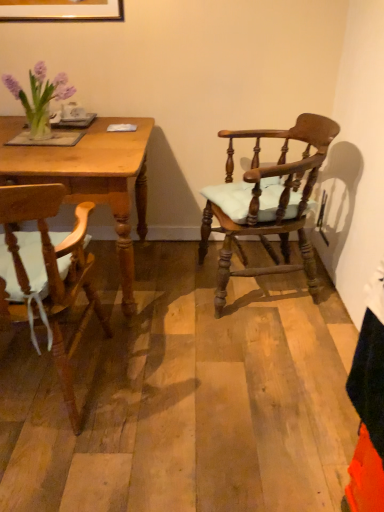
Question: From the image's perspective, is wooden chair with cushion at left, which appears as the 1th chair when viewed from the left, located beneath wooden table at left?

Choices:
 (A) yes
 (B) no

Answer: (A)

Question: Considering the relative positions of wooden chair with cushion at left, which is counted as the second chair, starting from the right, and wooden table at left in the image provided, is wooden chair with cushion at left, which is counted as the second chair, starting from the right, to the right of wooden table at left from the viewer's perspective?

Choices:
 (A) no
 (B) yes

Answer: (B)

Question: Are wooden chair with cushion at left, which is counted as the second chair, starting from the right, and wooden table at left making contact?

Choices:
 (A) no
 (B) yes

Answer: (A)

Question: Is wooden chair with cushion at left, which appears as the 1th chair when viewed from the left, looking in the opposite direction of wooden table at left?

Choices:
 (A) no
 (B) yes

Answer: (A)

Question: Would you say wooden chair with cushion at left, which appears as the 1th chair when viewed from the left, is outside wooden table at left?

Choices:
 (A) yes
 (B) no

Answer: (A)

Question: In terms of height, does wooden chair with cushion at right, placed as the second chair when sorted from left to right, look taller or shorter compared to wooden chair with cushion at left, which appears as the 1th chair when viewed from the left?

Choices:
 (A) short
 (B) tall

Answer: (A)

Question: Based on their positions, is wooden chair with cushion at right, the 1th chair positioned from the right, located to the left or right of wooden chair with cushion at left, which is counted as the second chair, starting from the right?

Choices:
 (A) right
 (B) left

Answer: (A)

Question: Is wooden chair with cushion at right, placed as the second chair when sorted from left to right, wider or thinner than wooden chair with cushion at left, which appears as the 1th chair when viewed from the left?

Choices:
 (A) thin
 (B) wide

Answer: (A)

Question: Is wooden chair with cushion at right, the 1th chair positioned from the right, bigger or smaller than wooden chair with cushion at left, which appears as the 1th chair when viewed from the left?

Choices:
 (A) big
 (B) small

Answer: (A)

Question: From the image's perspective, is wooden chair with cushion at right, the 1th chair positioned from the right, positioned above or below wooden table at left?

Choices:
 (A) above
 (B) below

Answer: (A)

Question: From a real-world perspective, is wooden chair with cushion at right, placed as the second chair when sorted from left to right, above or below wooden table at left?

Choices:
 (A) above
 (B) below

Answer: (A)

Question: Is point coord(203,227) closer or farther from the camera than point coord(125,199)?

Choices:
 (A) farther
 (B) closer

Answer: (A)

Question: Looking at their shapes, would you say wooden chair with cushion at right, placed as the second chair when sorted from left to right, is wider or thinner than wooden table at left?

Choices:
 (A) wide
 (B) thin

Answer: (B)

Question: Considering the positions of wooden chair with cushion at left, which appears as the 1th chair when viewed from the left, and wooden chair with cushion at right, the 1th chair positioned from the right, in the image, is wooden chair with cushion at left, which appears as the 1th chair when viewed from the left, bigger or smaller than wooden chair with cushion at right, the 1th chair positioned from the right,?

Choices:
 (A) small
 (B) big

Answer: (A)

Question: Is wooden chair with cushion at left, which appears as the 1th chair when viewed from the left, taller or shorter than wooden chair with cushion at right, placed as the second chair when sorted from left to right?

Choices:
 (A) tall
 (B) short

Answer: (A)